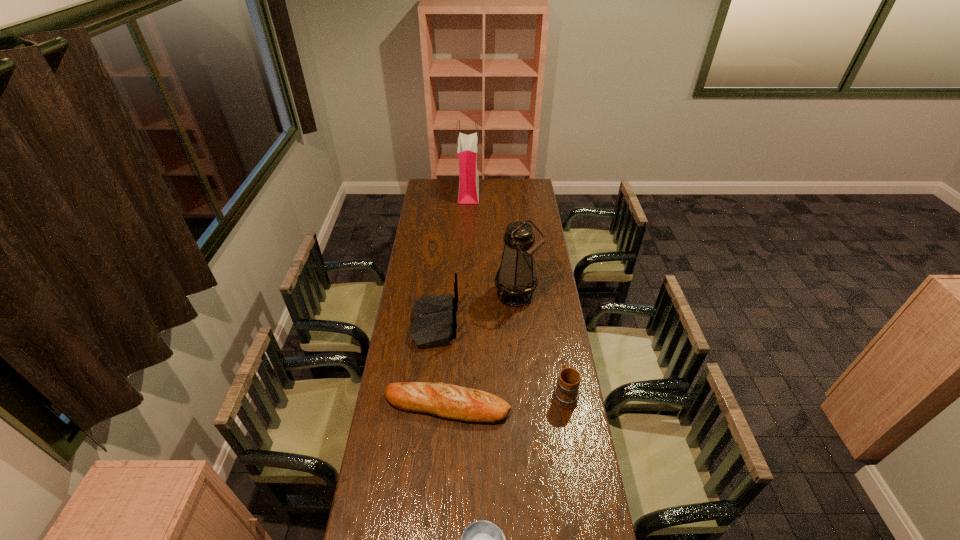
What are the coordinates of `the farthest object` in the screenshot? It's located at (468, 192).

The image size is (960, 540). Find the location of `oil lamp`. oil lamp is located at coordinates (516, 279).

Where is `the fourth shortest object`? This screenshot has width=960, height=540. the fourth shortest object is located at coordinates (434, 323).

I want to click on mug, so click(x=565, y=395).

Where is `baguet`? This screenshot has height=540, width=960. baguet is located at coordinates (449, 401).

The height and width of the screenshot is (540, 960). In order to click on free region located 0.120m on the front-facing side of the shopping bag in this screenshot , I will do `click(498, 191)`.

Where is `vacant space located on the left of the oil lamp`? Image resolution: width=960 pixels, height=540 pixels. vacant space located on the left of the oil lamp is located at coordinates (469, 295).

What are the coordinates of `vacant space positioned 0.160m on the back of the third tallest object` in the screenshot? It's located at (493, 323).

Where is `free region located on the side of the fourth tallest object with the handle`? free region located on the side of the fourth tallest object with the handle is located at coordinates (556, 344).

Locate an element on the screen. Image resolution: width=960 pixels, height=540 pixels. blank area located 0.140m on the side of the fourth tallest object with the handle is located at coordinates (558, 352).